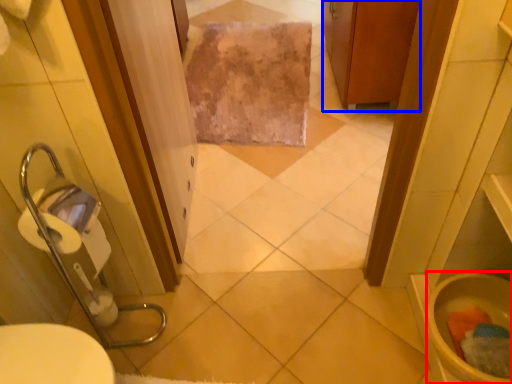
Question: Which point is further to the camera, toilet bowl (highlighted by a red box) or cabinetry (highlighted by a blue box)?

Choices:
 (A) toilet bowl
 (B) cabinetry

Answer: (B)